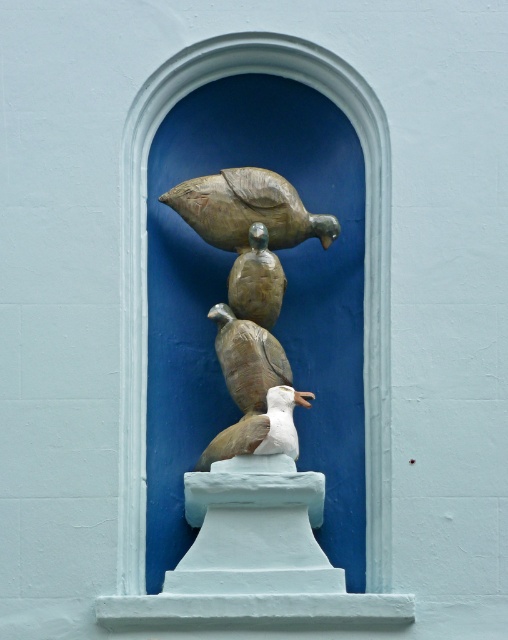
Question: Is bronze textured bird at center below matte brown bird at center?

Choices:
 (A) yes
 (B) no

Answer: (B)

Question: Considering the real-world distances, which object is farthest from the white matte bird at center?

Choices:
 (A) matte brown birds at center
 (B) bronze textured bird at center
 (C) matte brown bird at center

Answer: (B)

Question: Where is matte brown bird at center located in relation to white matte bird at center in the image?

Choices:
 (A) above
 (B) below

Answer: (A)

Question: Does bronze textured bird at center have a greater width compared to matte brown bird at center?

Choices:
 (A) no
 (B) yes

Answer: (A)

Question: Based on their relative distances, which object is nearer to the matte brown birds at center?

Choices:
 (A) matte brown bird at center
 (B) white matte bird at center
 (C) bronze textured bird at center

Answer: (A)

Question: Which point appears closest to the camera in this image?

Choices:
 (A) (174, 198)
 (B) (209, 461)
 (C) (236, 358)

Answer: (B)